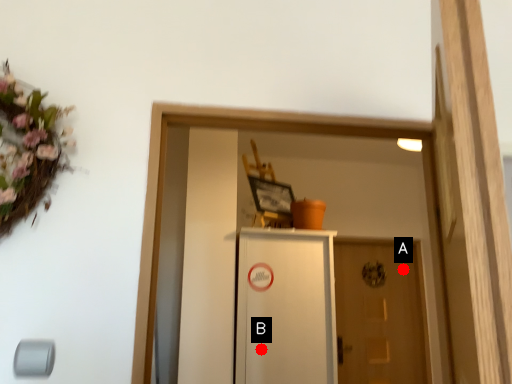
Question: Two points are circled on the image, labeled by A and B beside each circle. Which point is closer to the camera taking this photo?

Choices:
 (A) A is closer
 (B) B is closer

Answer: (B)